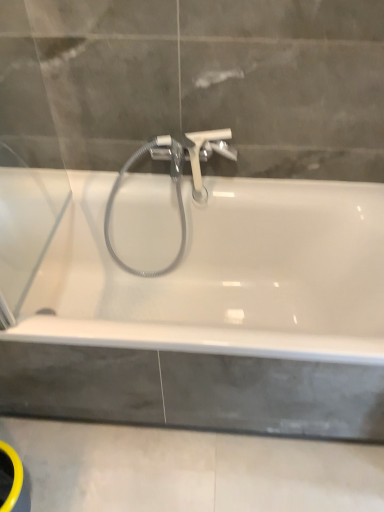
Question: Is the depth of white plastic tap at center greater than that of white glossy bathtub at center?

Choices:
 (A) yes
 (B) no

Answer: (A)

Question: Does white plastic tap at center have a larger size compared to white glossy bathtub at center?

Choices:
 (A) yes
 (B) no

Answer: (B)

Question: Does white plastic tap at center touch white glossy bathtub at center?

Choices:
 (A) no
 (B) yes

Answer: (A)

Question: Would you say white plastic tap at center is outside white glossy bathtub at center?

Choices:
 (A) yes
 (B) no

Answer: (A)

Question: From the image's perspective, is white plastic tap at center above white glossy bathtub at center?

Choices:
 (A) no
 (B) yes

Answer: (B)

Question: Are white plastic tap at center and white glossy bathtub at center far apart?

Choices:
 (A) no
 (B) yes

Answer: (A)

Question: Considering the relative sizes of white glossy bathtub at center and white plastic tap at center in the image provided, is white glossy bathtub at center shorter than white plastic tap at center?

Choices:
 (A) no
 (B) yes

Answer: (A)

Question: From the image's perspective, does white glossy bathtub at center appear lower than white plastic tap at center?

Choices:
 (A) no
 (B) yes

Answer: (B)

Question: Does white glossy bathtub at center come behind white plastic tap at center?

Choices:
 (A) yes
 (B) no

Answer: (B)

Question: Is white glossy bathtub at center bigger than white plastic tap at center?

Choices:
 (A) no
 (B) yes

Answer: (B)

Question: From a real-world perspective, is white glossy bathtub at center physically above white plastic tap at center?

Choices:
 (A) no
 (B) yes

Answer: (A)

Question: Are white glossy bathtub at center and white plastic tap at center located far from each other?

Choices:
 (A) yes
 (B) no

Answer: (B)

Question: Is white glossy bathtub at center positioned beyond the bounds of concreteroughbath edge at lower center?

Choices:
 (A) no
 (B) yes

Answer: (B)